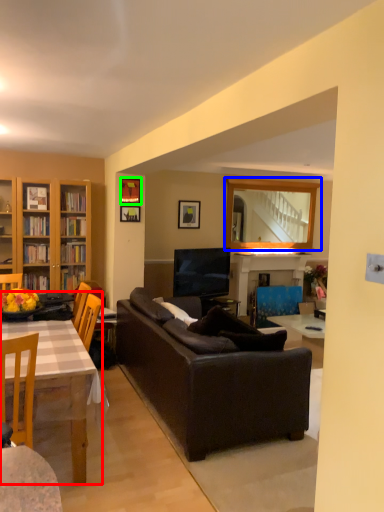
Question: Which is nearer to the table (highlighted by a red box)? mirror (highlighted by a blue box) or picture frame (highlighted by a green box).

Choices:
 (A) mirror
 (B) picture frame

Answer: (B)